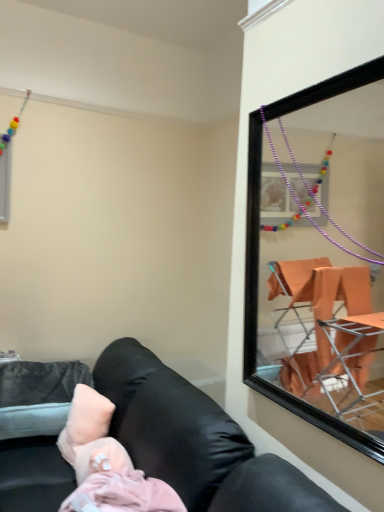
This screenshot has height=512, width=384. I want to click on pink fabric pillow at lower left, so click(85, 421).

What is the approximate width of black leather couch at lower left?

It is 32.97 inches.

The width and height of the screenshot is (384, 512). What are the coordinates of `pink fabric pillow at lower left` in the screenshot? It's located at (85, 421).

Does black leather couch at lower left have a lesser height compared to pink fabric at lower left?

No, black leather couch at lower left is not shorter than pink fabric at lower left.

Which object is thinner, black leather couch at lower left or pink fabric at lower left?

pink fabric at lower left.

Between black leather couch at lower left and pink fabric at lower left, which one appears on the right side from the viewer's perspective?

pink fabric at lower left is more to the right.

The width and height of the screenshot is (384, 512). Identify the location of pillow that appears above the black leather couch at lower left (from a real-world perspective). click(85, 421).

Is pink fabric pillow at lower left in front of or behind black leather couch at lower left in the image?

pink fabric pillow at lower left is behind black leather couch at lower left.

Considering the relative sizes of pink fabric pillow at lower left and black leather couch at lower left in the image provided, is pink fabric pillow at lower left thinner than black leather couch at lower left?

Yes.

From a real-world perspective, between pink fabric pillow at lower left and black leather couch at lower left, who is vertically lower?

black leather couch at lower left is physically lower.

Is point (173, 507) farther from camera compared to point (234, 467)?

No, (173, 507) is in front of (234, 467).

Is pink fabric at lower left smaller than black leather couch at lower left?

Correct, pink fabric at lower left occupies less space than black leather couch at lower left.

Are pink fabric at lower left and black leather couch at lower left far apart?

No, pink fabric at lower left is in close proximity to black leather couch at lower left.

In the scene shown: From a real-world perspective, between black leather couch at lower left and pink fabric pillow at lower left, who is vertically higher?

In real-world perspective, pink fabric pillow at lower left is above.

Can you see black leather couch at lower left touching pink fabric pillow at lower left?

They are not placed beside each other.

Is black leather couch at lower left inside or outside of pink fabric pillow at lower left?

black leather couch at lower left is spatially situated outside pink fabric pillow at lower left.

Considering the sizes of pink fabric at lower left and pink fabric pillow at lower left in the image, is pink fabric at lower left taller or shorter than pink fabric pillow at lower left?

Clearly, pink fabric at lower left is shorter compared to pink fabric pillow at lower left.

From a real-world perspective, does pink fabric at lower left stand above pink fabric pillow at lower left?

Yes, from a real-world perspective, pink fabric at lower left is on top of pink fabric pillow at lower left.

Can you confirm if pink fabric at lower left is wider than pink fabric pillow at lower left?

Yes.

Does point (98, 428) lie behind point (92, 446)?

Yes, it is behind point (92, 446).

From a real-world perspective, which object stands above the other?

pink fabric at lower left.

From the picture: From the image's perspective, which is below, pink fabric pillow at lower left or pink fabric at lower left?

pink fabric at lower left appears lower in the image.

This screenshot has height=512, width=384. Find the location of `studio couch located in front of the pink fabric at lower left`. studio couch located in front of the pink fabric at lower left is located at coordinates (195, 440).

Locate an element on the screen. This screenshot has width=384, height=512. studio couch lying below the pink fabric pillow at lower left (from the image's perspective) is located at coordinates (195, 440).

Which object lies nearer to the anchor point pink fabric pillow at lower left, black leather couch at lower left or pink fabric at lower left?

The object closer to pink fabric pillow at lower left is pink fabric at lower left.

From the image, which object appears to be farther from pink fabric pillow at lower left, pink fabric at lower left or black leather couch at lower left?

black leather couch at lower left lies further to pink fabric pillow at lower left than the other object.

Considering their positions, is black leather couch at lower left positioned closer to pink fabric at lower left than pink fabric pillow at lower left?

black leather couch at lower left.

When comparing their distances from black leather couch at lower left, does pink fabric at lower left or pink fabric pillow at lower left seem further?

Based on the image, pink fabric pillow at lower left appears to be further to black leather couch at lower left.

When comparing their distances from black leather couch at lower left, does pink fabric pillow at lower left or pink fabric at lower left seem further?

pink fabric pillow at lower left.

Which object lies further to the anchor point pink fabric at lower left, pink fabric pillow at lower left or black leather couch at lower left?

pink fabric pillow at lower left is further to pink fabric at lower left.

Where is `person located between black leather couch at lower left and pink fabric pillow at lower left in the depth direction`? person located between black leather couch at lower left and pink fabric pillow at lower left in the depth direction is located at coordinates (116, 482).